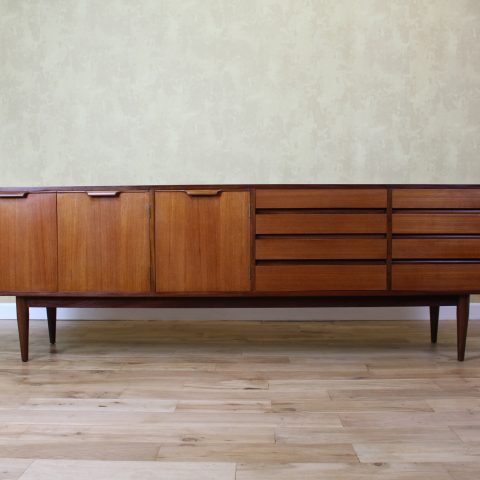
Locate an element on the screen. The height and width of the screenshot is (480, 480). white baseboard is located at coordinates (235, 314), (4, 310), (476, 309).